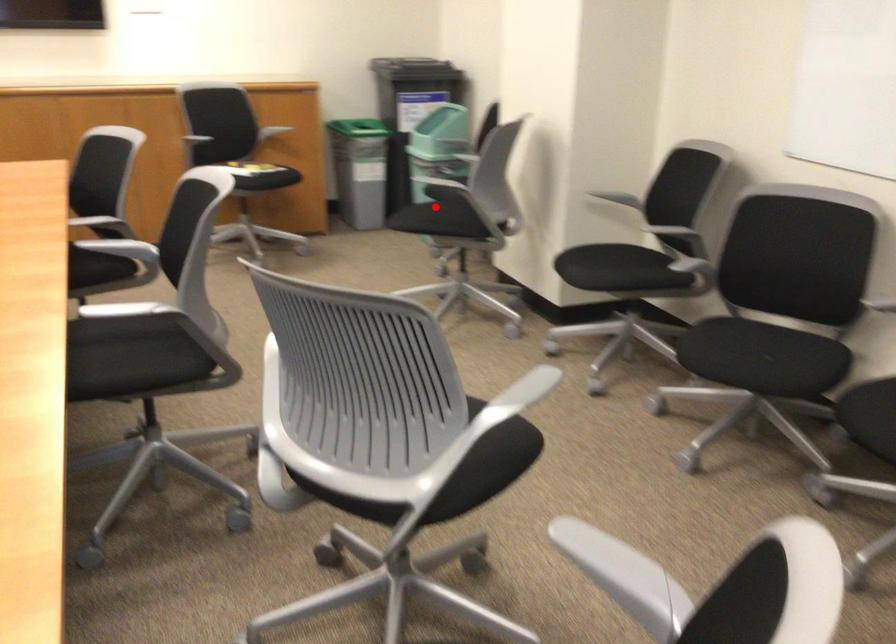
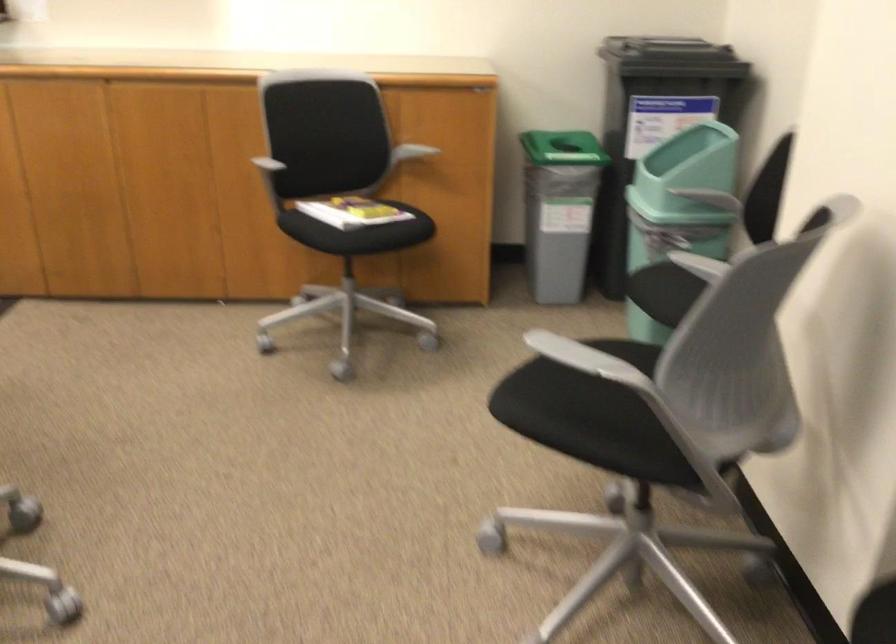
Question: I am providing you with two images of the same scene from different viewpoints. In image1, a red point is highlighted. Considering the same 3D point in image2, which of the following is correct?

Choices:
 (A) It is closer
 (B) It is farther

Answer: (A)